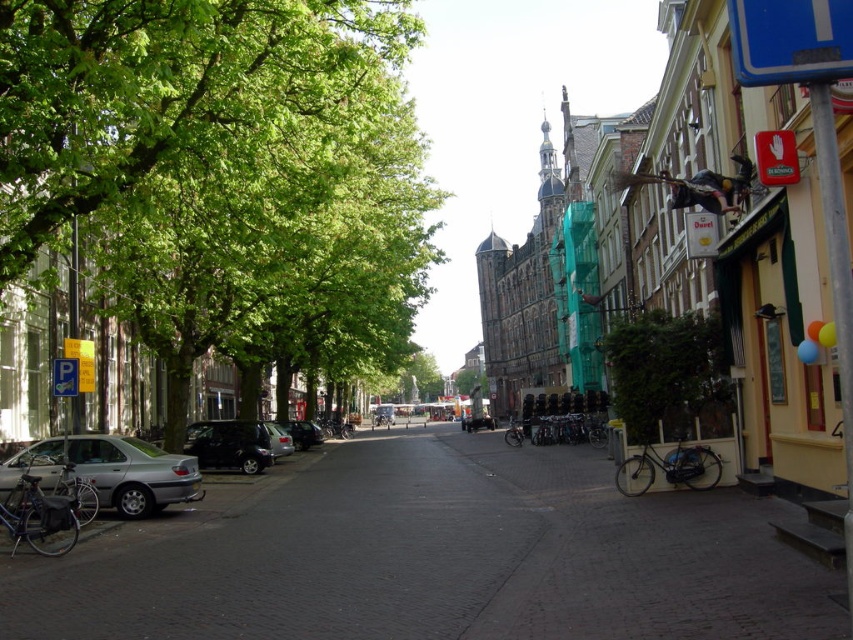
Question: Does black matte bicycle at center appear under silver metallic car at center?

Choices:
 (A) no
 (B) yes

Answer: (B)

Question: Which of the following is the farthest from the observer?

Choices:
 (A) silver metallic bicycle at center
 (B) shiny black suv at center-left
 (C) green leafy tree at left

Answer: (A)

Question: Observing the image, what is the correct spatial positioning of shiny black bicycle at lower right in reference to shiny metallic bicycle at center?

Choices:
 (A) left
 (B) right

Answer: (B)

Question: Which of the following is the closest to the observer?

Choices:
 (A) (578, 429)
 (B) (61, 196)
 (C) (374, 422)
 (D) (126, 476)

Answer: (B)

Question: Is dark gray cobblestone pavement at center further to camera compared to silver metallic car at center?

Choices:
 (A) yes
 (B) no

Answer: (B)

Question: Which object is closer to the camera taking this photo?

Choices:
 (A) green leafy tree at left
 (B) shiny black suv at center-left

Answer: (A)